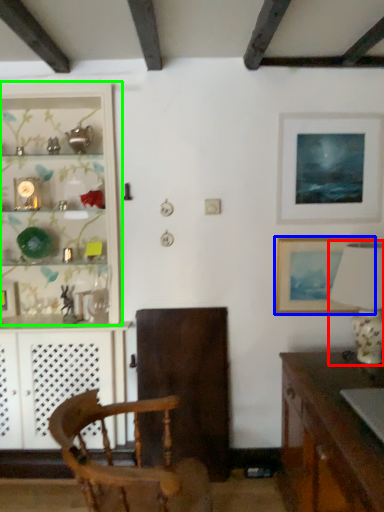
Question: Estimate the real-world distances between objects in this image. Which object is closer to lamp (highlighted by a red box), picture frame (highlighted by a blue box) or shelf (highlighted by a green box)?

Choices:
 (A) picture frame
 (B) shelf

Answer: (A)